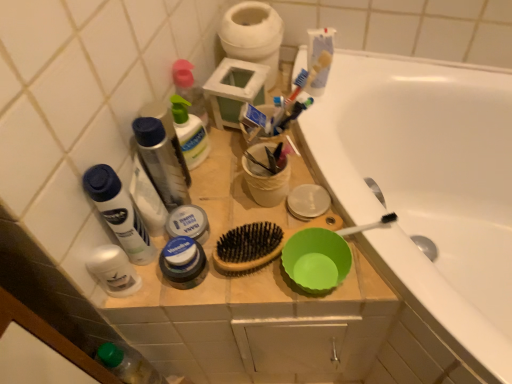
Question: Which is correct: green plastic bowl at center, positioned as the third basin in top-to-bottom order, is inside white matte jar at center, which is the 3th toiletry in top-to-bottom order, or outside of it?

Choices:
 (A) inside
 (B) outside

Answer: (B)

Question: In terms of size, does green plastic bowl at center, which is the 1th basin in bottom-to-top order, appear bigger or smaller than white matte jar at center, which is the 3th toiletry in top-to-bottom order?

Choices:
 (A) small
 (B) big

Answer: (B)

Question: Which object is the farthest from the translucent plastic spray bottle at upper center?

Choices:
 (A) white matte deodorant at left, marked as the 5th toiletry in a top-to-bottom arrangement
 (B) green plastic bowl at center, which is the 1th basin in bottom-to-top order
 (C) translucent plastic spray bottle at upper left, which is the first toiletry from top to bottom
 (D) white ceramic bathtub at upper right
 (E) translucent plastic mouthwash at upper left

Answer: (D)

Question: Which object is positioned closest to the white matte toothpaste at center, which is the first toothpaste in left-to-right order?

Choices:
 (A) translucent plastic spray bottle at upper center
 (B) white matte deodorant at left, marked as the 5th toiletry in a top-to-bottom arrangement
 (C) white matte deodorant at left, which is the fourth toiletry in bottom-to-top order
 (D) translucent plastic mouthwash at upper left
 (E) white matte toilet paper at upper center

Answer: (A)